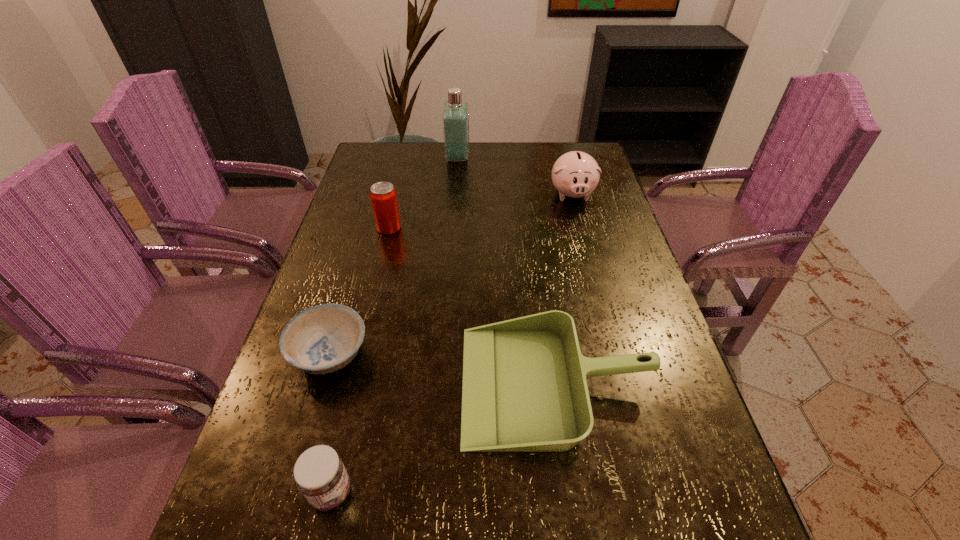
Find the location of a particular element. This screenshot has width=960, height=540. vacant space in between the fourth object from left to right and the dustpan is located at coordinates (507, 271).

You are a GUI agent. You are given a task and a screenshot of the screen. Output one action in this format:
    pyautogui.click(x=<x>, y=<y>)
    Task: Click on the vacant space that is in between the can and the shortest object
    Image resolution: width=960 pixels, height=540 pixels.
    Given the screenshot: What is the action you would take?
    coord(359,291)

The image size is (960, 540). Identify the location of vacant space that is in between the fourth nearest object and the nearest object. (360, 360).

I want to click on free space between the tallest object and the jam, so click(395, 325).

This screenshot has width=960, height=540. What are the coordinates of `free space between the can and the farthest object` in the screenshot? It's located at (423, 193).

Where is `object that is the second closest to the fifth nearest object`? object that is the second closest to the fifth nearest object is located at coordinates (383, 196).

Locate an element on the screen. This screenshot has width=960, height=540. object that is the third closest to the dustpan is located at coordinates (383, 196).

Locate an element on the screen. Image resolution: width=960 pixels, height=540 pixels. vacant area that satisfies the following two spatial constraints: 1. on the front label of the piggy bank; 2. on the left side of the tallest object is located at coordinates (455, 193).

Identify the location of vacant space that satisfies the following two spatial constraints: 1. on the front label of the farthest object; 2. on the right side of the fifth nearest object. This screenshot has width=960, height=540. (455, 193).

This screenshot has width=960, height=540. Find the location of `free space that satisfies the following two spatial constraints: 1. on the back side of the third farthest object; 2. on the left side of the piggy bank`. free space that satisfies the following two spatial constraints: 1. on the back side of the third farthest object; 2. on the left side of the piggy bank is located at coordinates (397, 193).